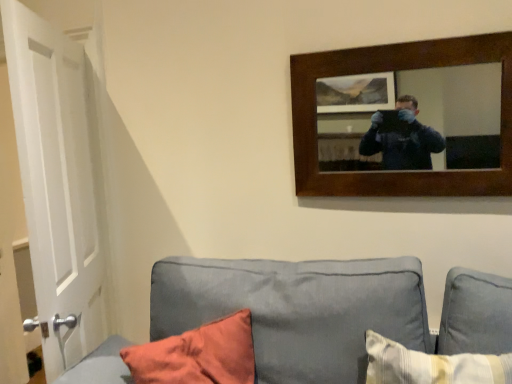
Find the location of a particular element. The height and width of the screenshot is (384, 512). gray fabric couch at lower center is located at coordinates (330, 311).

Describe the element at coordinates (330, 311) in the screenshot. I see `gray fabric couch at lower center` at that location.

This screenshot has width=512, height=384. I want to click on wooden-framed mirror at upper right, so click(413, 122).

At what (x,y) coordinates should I click in order to perform the action: click on mirror located behind the white matte door at left. Please return your answer as a coordinate pair (x, y). Image resolution: width=512 pixels, height=384 pixels. Looking at the image, I should click on (413, 122).

From the image's perspective, would you say wooden-framed mirror at upper right is shown under white matte door at left?

Incorrect, from the image's perspective, wooden-framed mirror at upper right is higher than white matte door at left.

Can white matte door at left be found inside wooden-framed mirror at upper right?

Definitely not — white matte door at left is not inside wooden-framed mirror at upper right.

Identify the location of mirror that appears above the gray fabric couch at lower center (from a real-world perspective). (413, 122).

Would you say gray fabric couch at lower center contains wooden-framed mirror at upper right?

No, wooden-framed mirror at upper right is not surrounded by gray fabric couch at lower center.

Is gray fabric couch at lower center positioned with its back to wooden-framed mirror at upper right?

gray fabric couch at lower center does not have its back to wooden-framed mirror at upper right.

Is the depth of gray fabric couch at lower center less than that of wooden-framed mirror at upper right?

Yes, it is in front of wooden-framed mirror at upper right.

From a real-world perspective, is gray fabric couch at lower center below white matte door at left?

→ Correct, in the physical world, gray fabric couch at lower center is lower than white matte door at left.

Is gray fabric couch at lower center positioned far away from white matte door at left?

No, gray fabric couch at lower center is not far from white matte door at left.

Is point (347, 106) closer or farther from the camera than point (366, 290)?

Point (347, 106) is positioned farther from the camera compared to point (366, 290).

How different are the orientations of wooden-framed mirror at upper right and gray fabric couch at lower center in degrees?

1.56 degrees separate the facing orientations of wooden-framed mirror at upper right and gray fabric couch at lower center.

In the scene shown: Is gray fabric couch at lower center completely or partially inside wooden-framed mirror at upper right?

No, wooden-framed mirror at upper right does not contain gray fabric couch at lower center.

From the image's perspective, is wooden-framed mirror at upper right located beneath gray fabric couch at lower center?

Incorrect, from the image's perspective, wooden-framed mirror at upper right is higher than gray fabric couch at lower center.

What are the coordinates of `door to the left of wooden-framed mirror at upper right` in the screenshot? It's located at (56, 185).

Does white matte door at left have a lesser height compared to wooden-framed mirror at upper right?

No.

Does point (82, 128) come in front of point (365, 109)?

No.

Could you tell me if white matte door at left is facing wooden-framed mirror at upper right?

No, white matte door at left is not facing towards wooden-framed mirror at upper right.

Is white matte door at left taller than gray fabric couch at lower center?

Yes, white matte door at left is taller than gray fabric couch at lower center.

Between white matte door at left and gray fabric couch at lower center, which one is positioned in front?

gray fabric couch at lower center is more forward.

From a real-world perspective, does white matte door at left stand above gray fabric couch at lower center?

Indeed, from a real-world perspective, white matte door at left stands above gray fabric couch at lower center.

Are white matte door at left and gray fabric couch at lower center making contact?

No, white matte door at left is not next to gray fabric couch at lower center.

Where is `door below the wooden-framed mirror at upper right (from the image's perspective)`? The height and width of the screenshot is (384, 512). door below the wooden-framed mirror at upper right (from the image's perspective) is located at coordinates (56, 185).

This screenshot has width=512, height=384. There is a gray fabric couch at lower center. Find the location of `mirror above it (from a real-world perspective)`. mirror above it (from a real-world perspective) is located at coordinates (413, 122).

Considering their positions, is white matte door at left positioned further to wooden-framed mirror at upper right than gray fabric couch at lower center?

Among the two, white matte door at left is located further to wooden-framed mirror at upper right.

Estimate the real-world distances between objects in this image. Which object is closer to white matte door at left, wooden-framed mirror at upper right or gray fabric couch at lower center?

Based on the image, gray fabric couch at lower center appears to be nearer to white matte door at left.

Considering their positions, is white matte door at left positioned further to gray fabric couch at lower center than wooden-framed mirror at upper right?

Among the two, white matte door at left is located further to gray fabric couch at lower center.

When comparing their distances from wooden-framed mirror at upper right, does gray fabric couch at lower center or white matte door at left seem further?

white matte door at left is further to wooden-framed mirror at upper right.

Based on their spatial positions, is gray fabric couch at lower center or wooden-framed mirror at upper right closer to white matte door at left?

Among the two, gray fabric couch at lower center is located nearer to white matte door at left.

Looking at the image, which one is located closer to gray fabric couch at lower center, wooden-framed mirror at upper right or white matte door at left?

wooden-framed mirror at upper right is closer to gray fabric couch at lower center.

The height and width of the screenshot is (384, 512). I want to click on studio couch between white matte door at left and wooden-framed mirror at upper right from left to right, so click(x=330, y=311).